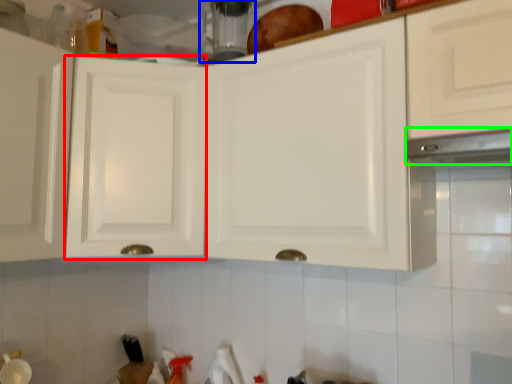
Question: Which object is positioned farthest from cabinetry (highlighted by a red box)? Select from appliance (highlighted by a blue box) and exhaust hood (highlighted by a green box).

Choices:
 (A) appliance
 (B) exhaust hood

Answer: (B)